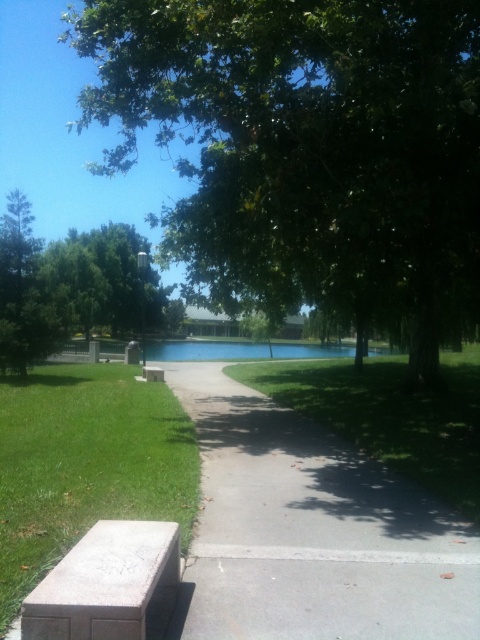
Question: Is green leafy tree at center further to camera compared to green grass at center?

Choices:
 (A) no
 (B) yes

Answer: (B)

Question: Among these points, which one is farthest from the camera?

Choices:
 (A) (317, 531)
 (B) (177, 579)
 (C) (345, 412)

Answer: (C)

Question: Among these points, which one is farthest from the camera?

Choices:
 (A) (108, 632)
 (B) (1, 284)
 (C) (182, 481)
 (D) (435, 404)

Answer: (B)

Question: Which object appears closest to the camera in this image?

Choices:
 (A) green leafy tree at center
 (B) green leafy tree at upper left
 (C) gray concrete pavement at center

Answer: (C)

Question: Is gray concrete pavement at center above green grass at center?

Choices:
 (A) yes
 (B) no

Answer: (B)

Question: In this image, where is gray concrete pavement at center located relative to gray concrete bench at lower left?

Choices:
 (A) right
 (B) left

Answer: (A)